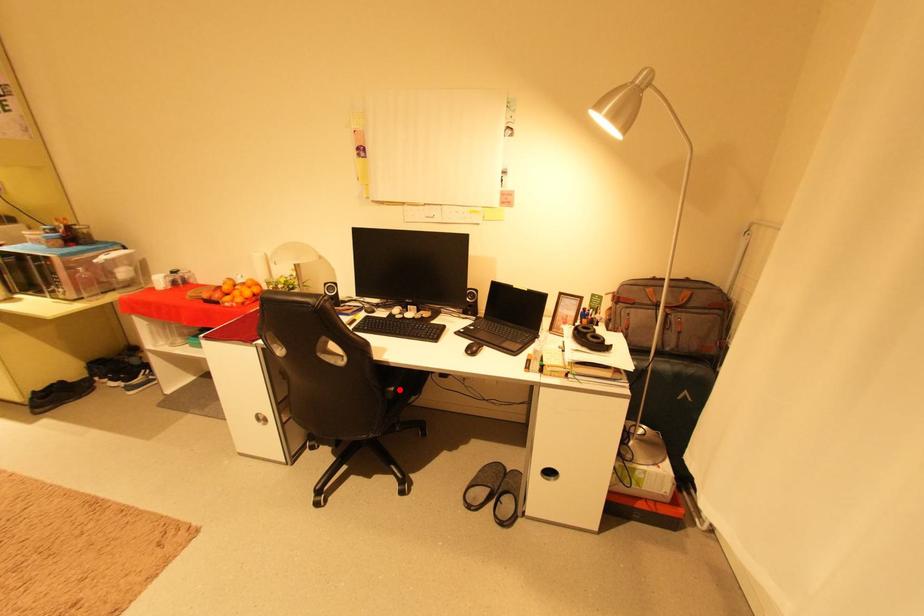
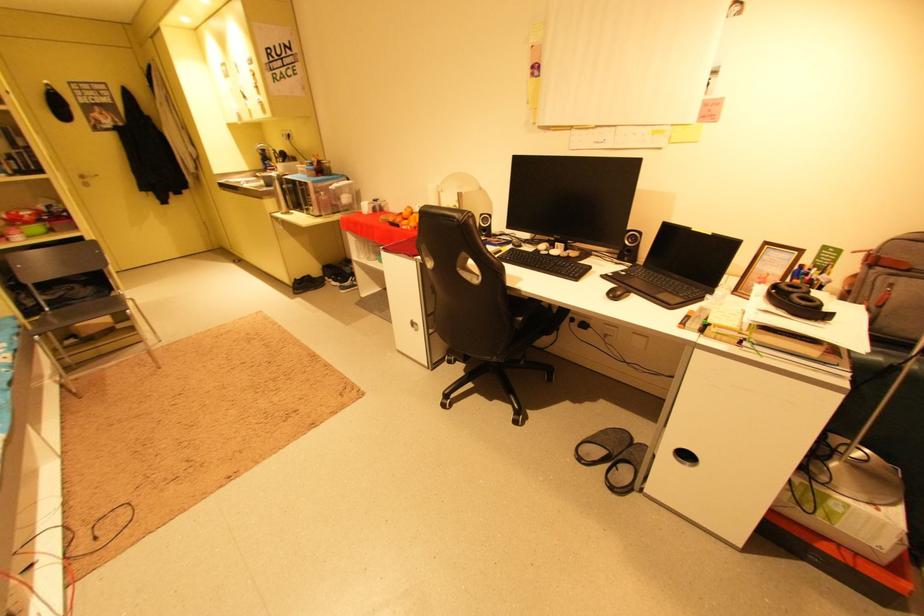
Question: I am providing you with two images of the same scene from different viewpoints. Image1 has a red point marked. In image2, the corresponding 3D location appears at what relative position? Reply with the corresponding letter.

Choices:
 (A) Closer
 (B) Farther

Answer: (B)